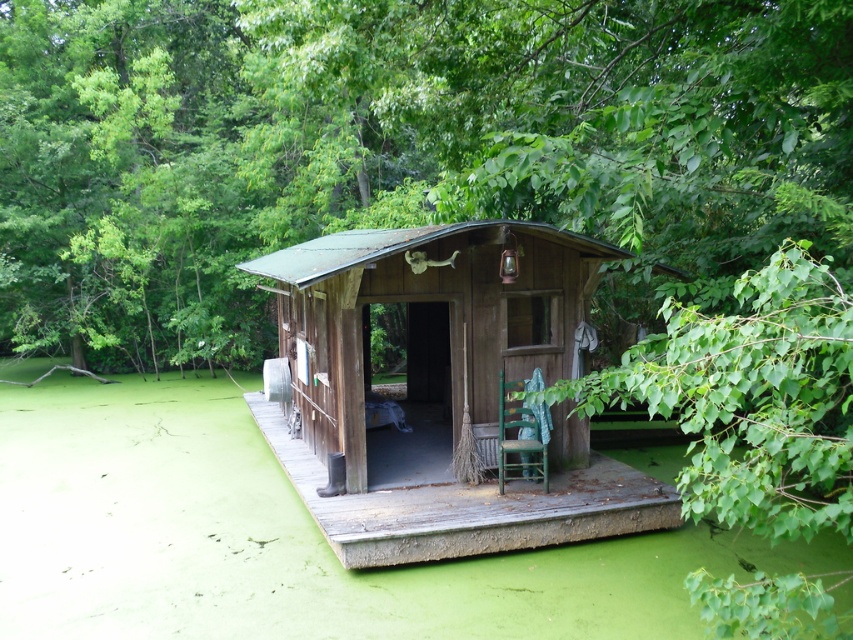
Based on the photo, is rustic wood cabin at center above green wooden chair at center?

Yes.

Which is in front, point (550, 282) or point (502, 472)?

Positioned in front is point (502, 472).

Identify the location of rustic wood cabin at center. This screenshot has width=853, height=640. (440, 388).

Looking at this image, measure the distance between green leafy tree at center and rustic wood cabin at center.

The distance of green leafy tree at center from rustic wood cabin at center is 8.70 meters.

Which is behind, point (309, 147) or point (503, 538)?

Positioned behind is point (309, 147).

Is point (653, 173) farther from viewer compared to point (357, 541)?

No, it is in front of (357, 541).

You are a GUI agent. You are given a task and a screenshot of the screen. Output one action in this format:
    pyautogui.click(x=<x>, y=<y>)
    Task: Click on the green leafy tree at center
    This screenshot has width=853, height=640.
    Given the screenshot: What is the action you would take?
    pyautogui.click(x=399, y=148)

Is point (755, 216) positioned before point (498, 371)?

Yes, it is.

Can you confirm if green leafy tree at center is smaller than green wooden chair at center?

No.

Who is more forward, (187,317) or (547,452)?

Point (547,452)

Identify the location of green leafy tree at center. This screenshot has width=853, height=640. (399, 148).